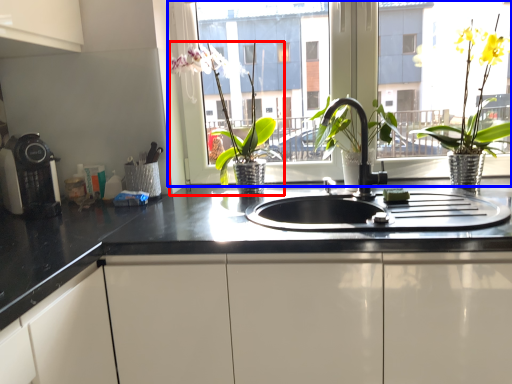
Question: Which object appears farthest to the camera in this image, houseplant (highlighted by a red box) or window (highlighted by a blue box)?

Choices:
 (A) houseplant
 (B) window

Answer: (B)